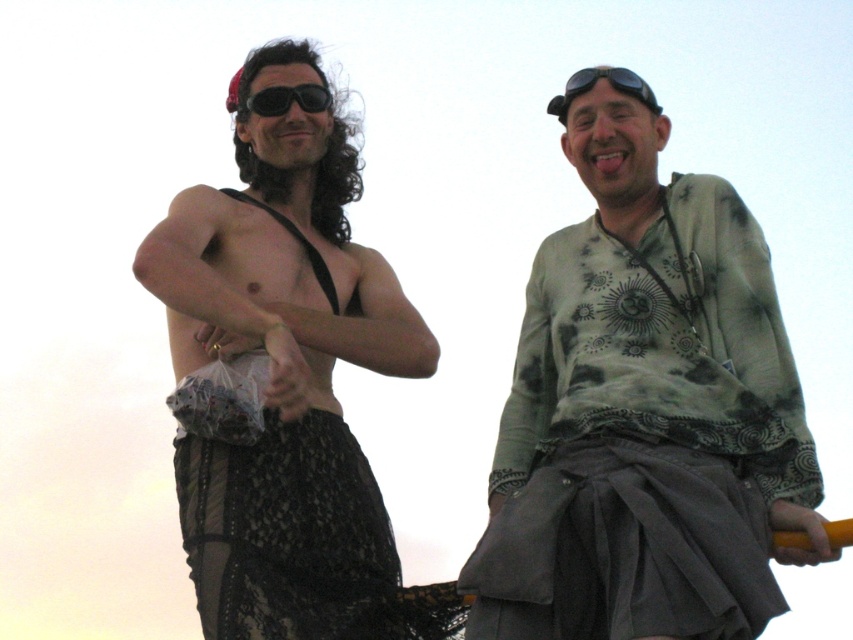
Question: Does green tie-dye shirt at upper right have a greater width compared to black matte goggles at upper center?

Choices:
 (A) yes
 (B) no

Answer: (A)

Question: Is green tie-dye shirt at upper right closer to the viewer compared to black lace skirt at left?

Choices:
 (A) yes
 (B) no

Answer: (A)

Question: Which of these objects is positioned closest to the black matte goggles at upper center?

Choices:
 (A) black lace skirt at left
 (B) green tie-dye shirt at upper right
 (C) black matte sunglasses at upper center

Answer: (B)

Question: Can you confirm if green tie-dye shirt at upper right is bigger than black matte goggles at upper center?

Choices:
 (A) yes
 (B) no

Answer: (A)

Question: Which of the following is the farthest from the observer?

Choices:
 (A) (616, 68)
 (B) (247, 108)

Answer: (B)

Question: Which object is the farthest from the green tie-dye shirt at upper right?

Choices:
 (A) black lace skirt at left
 (B) black matte sunglasses at upper center
 (C) black matte goggles at upper center

Answer: (B)